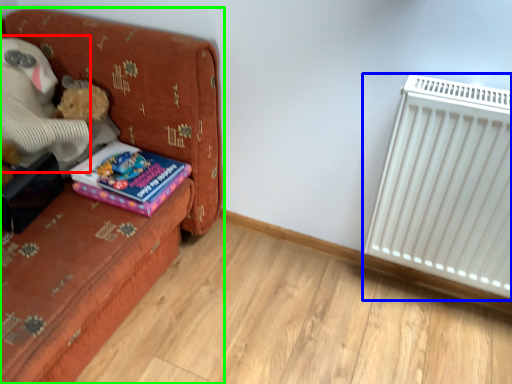
Question: Which object is positioned farthest from teddy (highlighted by a red box)? Select from radiator (highlighted by a blue box) and furniture (highlighted by a green box).

Choices:
 (A) radiator
 (B) furniture

Answer: (A)